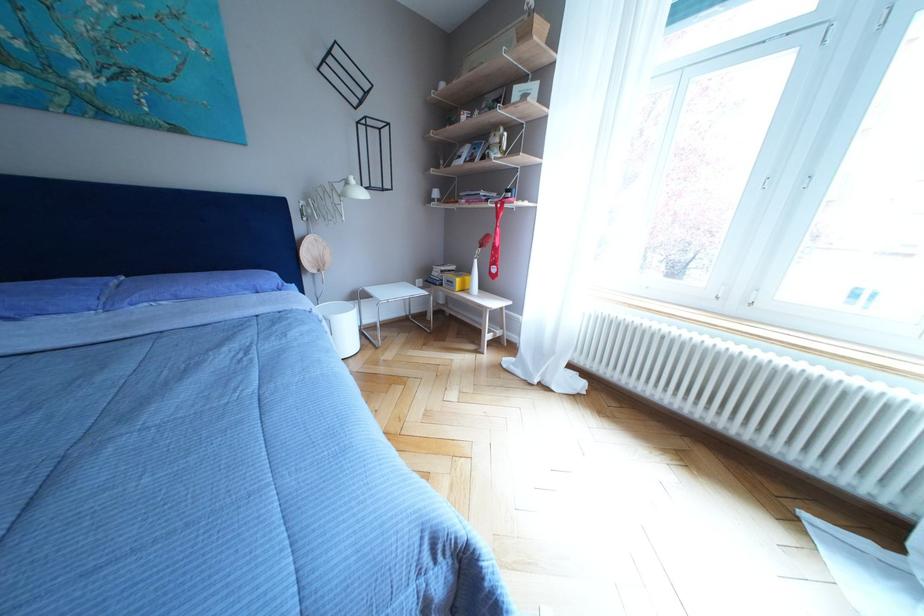
The height and width of the screenshot is (616, 924). Identify the location of white lamp head. (331, 200).